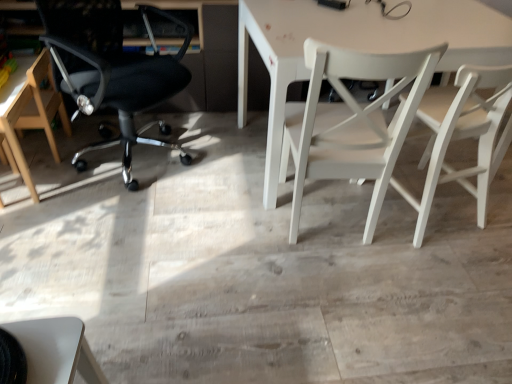
Question: Is white wood chair at right, which is the 1th chair in right-to-left order, looking in the opposite direction of black mesh office chair at left, the 2th chair in the left-to-right sequence?

Choices:
 (A) yes
 (B) no

Answer: (B)

Question: Is white wood chair at right, placed as the fourth chair when sorted from left to right, positioned in front of black mesh office chair at left, the 2th chair in the left-to-right sequence?

Choices:
 (A) yes
 (B) no

Answer: (A)

Question: Can you confirm if white wood chair at right, placed as the fourth chair when sorted from left to right, is wider than black mesh office chair at left, which is counted as the 3th chair, starting from the right?

Choices:
 (A) yes
 (B) no

Answer: (B)

Question: From the image's perspective, is white wood chair at right, placed as the fourth chair when sorted from left to right, located beneath black mesh office chair at left, which is counted as the 3th chair, starting from the right?

Choices:
 (A) no
 (B) yes

Answer: (B)

Question: From a real-world perspective, is white wood chair at right, placed as the fourth chair when sorted from left to right, on top of black mesh office chair at left, the 2th chair in the left-to-right sequence?

Choices:
 (A) yes
 (B) no

Answer: (B)

Question: Considering the relative positions of white wood chair at right, which is the 1th chair in right-to-left order, and black mesh office chair at left, the 2th chair in the left-to-right sequence, in the image provided, is white wood chair at right, which is the 1th chair in right-to-left order, to the left of black mesh office chair at left, the 2th chair in the left-to-right sequence, from the viewer's perspective?

Choices:
 (A) no
 (B) yes

Answer: (A)

Question: From the image's perspective, is white matte table at center located beneath light brown wooden chair at left, marked as the fourth chair in a right-to-left arrangement?

Choices:
 (A) no
 (B) yes

Answer: (A)

Question: From the image's perspective, is white matte table at center on light brown wooden chair at left, marked as the fourth chair in a right-to-left arrangement?

Choices:
 (A) no
 (B) yes

Answer: (B)

Question: Is white matte table at center wider than light brown wooden chair at left, which is the 1th chair from left to right?

Choices:
 (A) no
 (B) yes

Answer: (B)

Question: Is white matte table at center not inside light brown wooden chair at left, marked as the fourth chair in a right-to-left arrangement?

Choices:
 (A) no
 (B) yes

Answer: (B)

Question: Can you confirm if white matte table at center is taller than light brown wooden chair at left, marked as the fourth chair in a right-to-left arrangement?

Choices:
 (A) yes
 (B) no

Answer: (A)

Question: Is white matte table at center facing away from light brown wooden chair at left, which is the 1th chair from left to right?

Choices:
 (A) yes
 (B) no

Answer: (B)

Question: Can you confirm if light brown wooden chair at left, which is the 1th chair from left to right, is thinner than white wood chair at right, which is the 1th chair in right-to-left order?

Choices:
 (A) no
 (B) yes

Answer: (A)